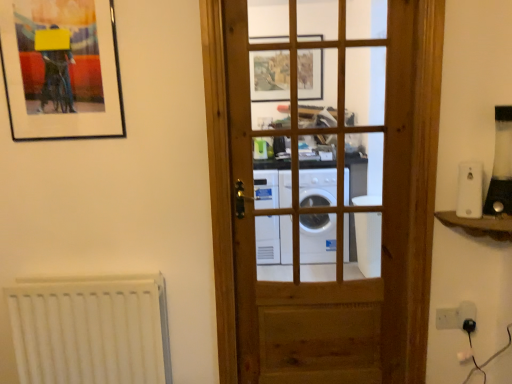
What do you see at coordinates (466, 312) in the screenshot?
I see `white plastic electric outlet at lower right` at bounding box center [466, 312].

Where is `wooden door at center`? The image size is (512, 384). wooden door at center is located at coordinates (323, 211).

This screenshot has width=512, height=384. Describe the element at coordinates (323, 211) in the screenshot. I see `wooden door at center` at that location.

Describe the element at coordinates (501, 166) in the screenshot. Image resolution: width=512 pixels, height=384 pixels. I see `black plastic blender at right, the second appliance from the left` at that location.

The height and width of the screenshot is (384, 512). What are the coordinates of `black plastic blender at right, marked as the 1th appliance in a right-to-left arrangement` in the screenshot? It's located at (501, 166).

In order to face white plastic light switch at right, the second appliance from the right, should I rotate leftwards or rightwards?

Rotate your view right by about 26.197°.

Where is `white plastic electric outlet at lower right`? The height and width of the screenshot is (384, 512). white plastic electric outlet at lower right is located at coordinates (466, 312).

Consider the image. Can matte black picture frame at upper left be found inside black plastic blender at right, marked as the 1th appliance in a right-to-left arrangement?

No, black plastic blender at right, marked as the 1th appliance in a right-to-left arrangement, does not contain matte black picture frame at upper left.

Locate an element on the screen. The image size is (512, 384). picture frame behind the black plastic blender at right, the second appliance from the left is located at coordinates (61, 69).

Which object is thinner, black plastic blender at right, marked as the 1th appliance in a right-to-left arrangement, or matte black picture frame at upper left?

Thinner between the two is matte black picture frame at upper left.

Is black plastic blender at right, the second appliance from the left, facing towards matte black picture frame at upper left?

No.

Are white plastic electric outlet at lower right and white plastic light switch at right, which is the 1th appliance from left to right, beside each other?

They are not placed beside each other.

Can you confirm if white plastic electric outlet at lower right is wider than white plastic light switch at right, the second appliance from the right?

No.

From the image's perspective, is white plastic electric outlet at lower right located above or below white plastic light switch at right, which is the 1th appliance from left to right?

From the image's perspective, white plastic electric outlet at lower right appears below white plastic light switch at right, which is the 1th appliance from left to right.

This screenshot has height=384, width=512. I want to click on electric outlet that is on the right side of white plastic light switch at lower right, so click(x=466, y=312).

From a real-world perspective, which is physically below, white plastic light switch at lower right or white plastic electric outlet at lower right?

From a 3D spatial view, white plastic light switch at lower right is below.

Which of these two, white plastic light switch at lower right or white plastic electric outlet at lower right, is bigger?

Bigger between the two is white plastic electric outlet at lower right.

Is white plastic light switch at lower right positioned beyond the bounds of white plastic electric outlet at lower right?

Absolutely, white plastic light switch at lower right is external to white plastic electric outlet at lower right.

Is wooden door at center positioned with its back to white matte radiator at lower left?

No, wooden door at center is not facing the opposite direction of white matte radiator at lower left.

Consider the image. Is wooden door at center taller or shorter than white matte radiator at lower left?

Considering their sizes, wooden door at center has more height than white matte radiator at lower left.

In the scene shown: Is wooden door at center situated inside white matte radiator at lower left or outside?

wooden door at center is spatially situated outside white matte radiator at lower left.

Considering the points (385, 321) and (42, 376), which point is in front, point (385, 321) or point (42, 376)?

The point (42, 376) is more forward.

Is white plastic electric outlet at lower right thinner than black plastic blender at right, the second appliance from the left?

Indeed, white plastic electric outlet at lower right has a lesser width compared to black plastic blender at right, the second appliance from the left.

Is white plastic electric outlet at lower right at the right side of black plastic blender at right, marked as the 1th appliance in a right-to-left arrangement?

In fact, white plastic electric outlet at lower right is to the left of black plastic blender at right, marked as the 1th appliance in a right-to-left arrangement.

Does white plastic electric outlet at lower right come behind black plastic blender at right, the second appliance from the left?

That is True.

Is white matte radiator at lower left thinner than wooden door at center?

Correct, the width of white matte radiator at lower left is less than that of wooden door at center.

Is point (110, 357) closer or farther from the camera than point (240, 20)?

Clearly, point (110, 357) is more distant from the camera than point (240, 20).

Could you tell me if white matte radiator at lower left is turned towards wooden door at center?

No, white matte radiator at lower left is not aimed at wooden door at center.

What's the angular difference between white matte radiator at lower left and wooden door at center's facing directions?

The facing directions of white matte radiator at lower left and wooden door at center are 0.388 degrees apart.

Is wooden door at center not inside white plastic light switch at lower right?

Indeed, wooden door at center is completely outside white plastic light switch at lower right.

Would you consider wooden door at center to be distant from white plastic light switch at lower right?

No, there isn't a large distance between wooden door at center and white plastic light switch at lower right.

In the scene shown: From a real-world perspective, is wooden door at center on top of white plastic light switch at lower right?

Correct, in the physical world, wooden door at center is higher than white plastic light switch at lower right.

Image resolution: width=512 pixels, height=384 pixels. Find the location of `picture frame on the left of the black plastic blender at right, the second appliance from the left`. picture frame on the left of the black plastic blender at right, the second appliance from the left is located at coordinates (61, 69).

Locate an element on the screen. The image size is (512, 384). electric outlet behind the white plastic light switch at right, which is the 1th appliance from left to right is located at coordinates (466, 312).

Considering their positions, is white plastic light switch at right, which is the 1th appliance from left to right, positioned further to white plastic electric outlet at lower right than matte black picture frame at upper left?

matte black picture frame at upper left lies further to white plastic electric outlet at lower right than the other object.

In the scene shown: Considering their positions, is white plastic light switch at right, the second appliance from the right, positioned closer to matte black picture frame at upper left than white plastic electric outlet at lower right?

Among the two, white plastic light switch at right, the second appliance from the right, is located nearer to matte black picture frame at upper left.

Based on their spatial positions, is wooden door at center or white plastic light switch at lower right closer to white plastic light switch at right, the second appliance from the right?

white plastic light switch at lower right is closer to white plastic light switch at right, the second appliance from the right.

Considering their positions, is white plastic electric outlet at lower right positioned closer to matte black picture frame at upper left than white matte radiator at lower left?

Based on the image, white matte radiator at lower left appears to be nearer to matte black picture frame at upper left.

Which object lies further to the anchor point white matte radiator at lower left, white plastic light switch at lower right or white plastic light switch at right, the second appliance from the right?

Based on the image, white plastic light switch at right, the second appliance from the right, appears to be further to white matte radiator at lower left.

When comparing their distances from white plastic light switch at right, which is the 1th appliance from left to right, does white plastic light switch at lower right or matte black picture frame at upper left seem further?

matte black picture frame at upper left is positioned further to the anchor white plastic light switch at right, which is the 1th appliance from left to right.

Considering their positions, is matte black picture frame at upper left positioned further to white plastic light switch at lower right than wooden door at center?

matte black picture frame at upper left is further to white plastic light switch at lower right.

When comparing their distances from black plastic blender at right, marked as the 1th appliance in a right-to-left arrangement, does white matte radiator at lower left or white plastic electric outlet at lower right seem closer?

white plastic electric outlet at lower right is closer to black plastic blender at right, marked as the 1th appliance in a right-to-left arrangement.

Locate an element on the screen. The image size is (512, 384). light switch located between matte black picture frame at upper left and black plastic blender at right, marked as the 1th appliance in a right-to-left arrangement, in the left-right direction is located at coordinates (447, 318).

At what (x,y) coordinates should I click in order to perform the action: click on appliance between matte black picture frame at upper left and black plastic blender at right, the second appliance from the left, in the horizontal direction. Please return your answer as a coordinate pair (x, y). This screenshot has height=384, width=512. Looking at the image, I should click on (470, 190).

You are a GUI agent. You are given a task and a screenshot of the screen. Output one action in this format:
    pyautogui.click(x=<x>, y=<y>)
    Task: Click on the electric outlet between white matte radiator at lower left and black plastic blender at right, marked as the 1th appliance in a right-to-left arrangement, from left to right
    This screenshot has width=512, height=384.
    Given the screenshot: What is the action you would take?
    pyautogui.click(x=466, y=312)

I want to click on light switch between white matte radiator at lower left and white plastic electric outlet at lower right in the horizontal direction, so click(447, 318).